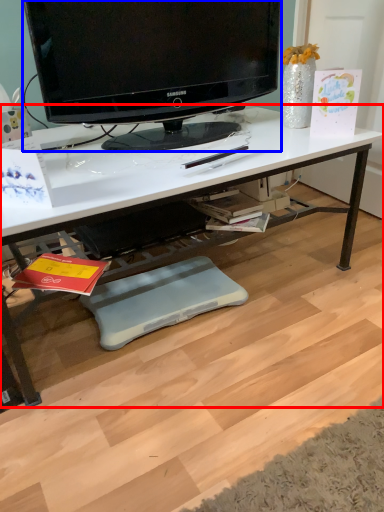
Question: Among these objects, which one is farthest to the camera, desk (highlighted by a red box) or television (highlighted by a blue box)?

Choices:
 (A) desk
 (B) television

Answer: (B)